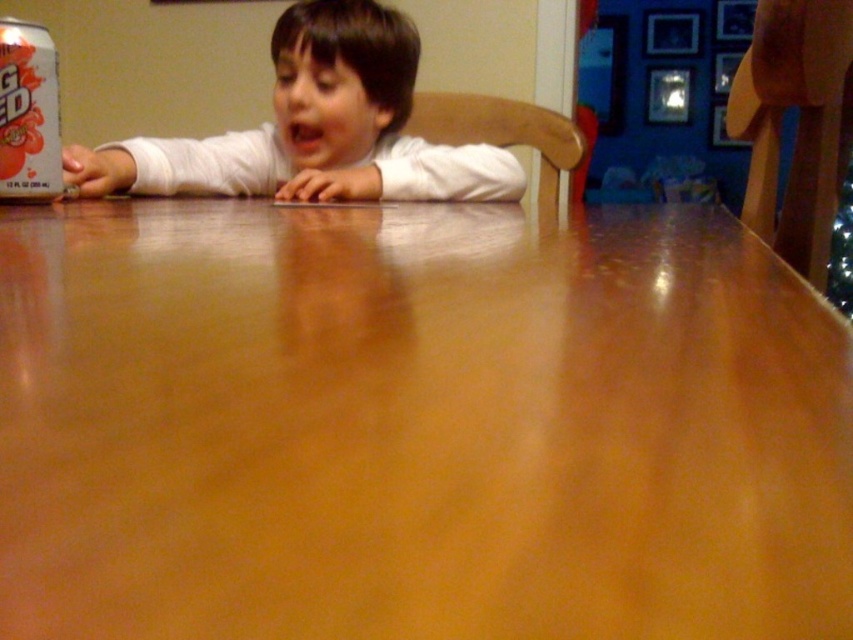
Which is above, white matte shirt at center or matte silver can at upper left?

white matte shirt at center

Does white matte shirt at center appear on the right side of matte silver can at upper left?

Indeed, white matte shirt at center is positioned on the right side of matte silver can at upper left.

Does point (308, 93) come farther from viewer compared to point (32, 152)?

Yes, point (308, 93) is behind point (32, 152).

Find the location of a particular element. The image size is (853, 640). white matte shirt at center is located at coordinates pyautogui.click(x=315, y=128).

Is point (33, 369) in front of point (20, 28)?

Yes, it is.

I want to click on wooden table at center, so click(x=415, y=426).

At what (x,y) coordinates should I click in order to perform the action: click on wooden table at center. Please return your answer as a coordinate pair (x, y). This screenshot has width=853, height=640. Looking at the image, I should click on (415, 426).

Image resolution: width=853 pixels, height=640 pixels. Find the location of `wooden table at center`. wooden table at center is located at coordinates (415, 426).

From the picture: Is wooden table at center further to the viewer compared to white matte shirt at center?

No, wooden table at center is closer to the viewer.

In order to click on wooden table at center in this screenshot , I will do `click(415, 426)`.